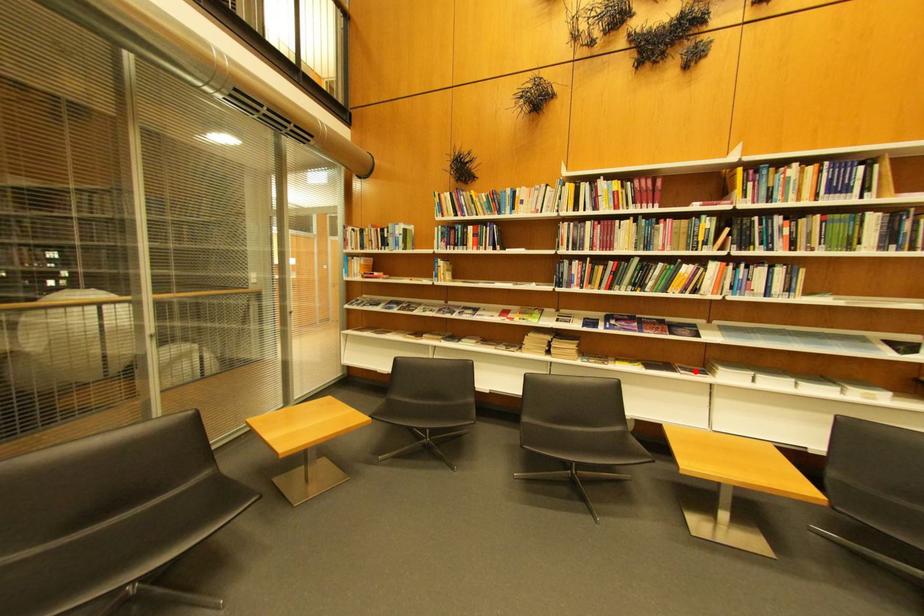
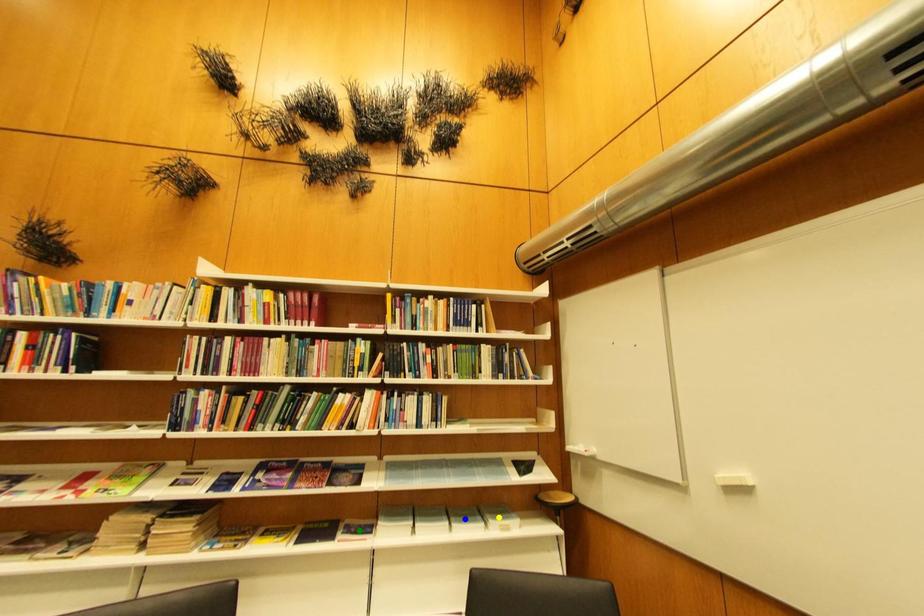
Question: I am providing you with two images of the same scene from different viewpoints. A red point is marked on the first image. You are given multiple points on the second image. Which point in image 2 represents the same 3d spot as the red point in image 1?

Choices:
 (A) blue point
 (B) green point
 (C) yellow point

Answer: (B)